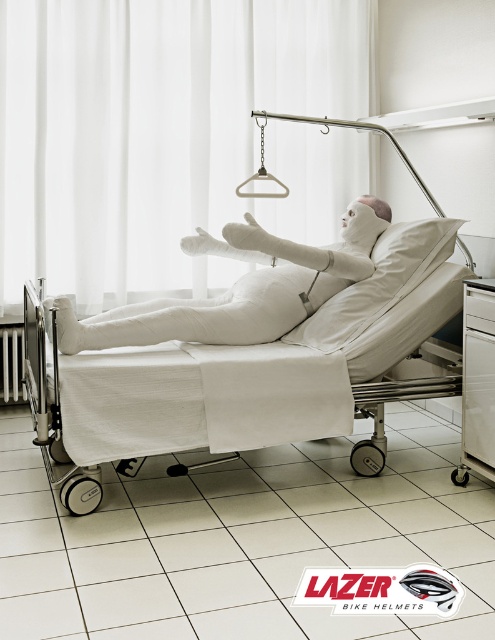
You are a nurse entering the hospital room and need to retrieve a medical supply from the white plastic drawer at lower right and adjust the white plastic radiator at lower left. Which object will you interact with first?

You will interact with the white plastic drawer at lower right first because it is closer to you than the white plastic radiator at lower left.

You are a nurse in a hospital room. You need to retrieve a medical tool from the white plastic drawer at lower right while attending to the white bandaged figure at center. Can you reach the drawer without moving the bed? The minimum distance required to move around the bed is 1.2 meters.

The white bandaged figure at center and white plastic drawer at lower right are 1.08 meters apart, which is less than the required 1.2 meters to move around the bed. Therefore, you cannot reach the drawer without moving the bed.

You are a nurse in a hospital room and need to retrieve medical supplies. The white plastic drawer at lower right is where you usually keep them. Can you estimate its position relative to the hospital bed?

The white plastic drawer at lower right is located at point 0.597 on the x axis and 0.966 on the y axis relative to the hospital bed.